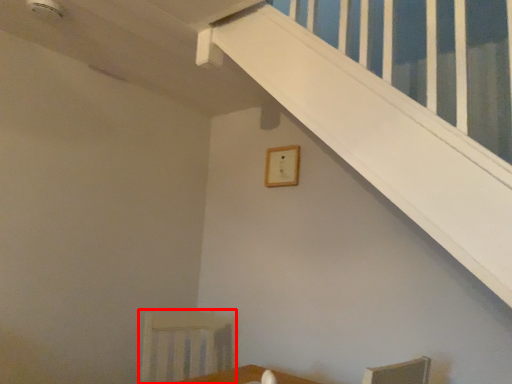
Question: From the image's perspective, where is armchair (annotated by the red box) located relative to picture frame?

Choices:
 (A) above
 (B) below

Answer: (B)